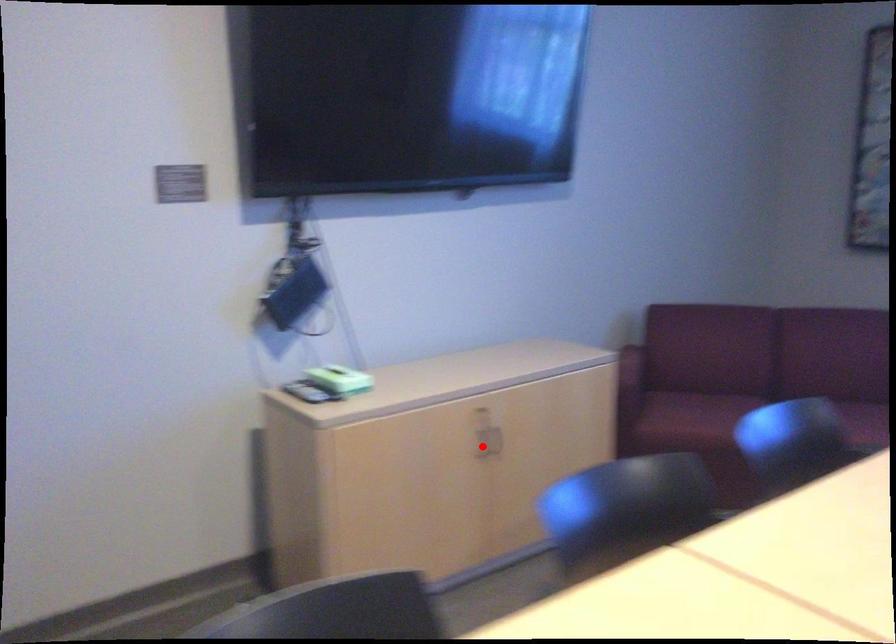
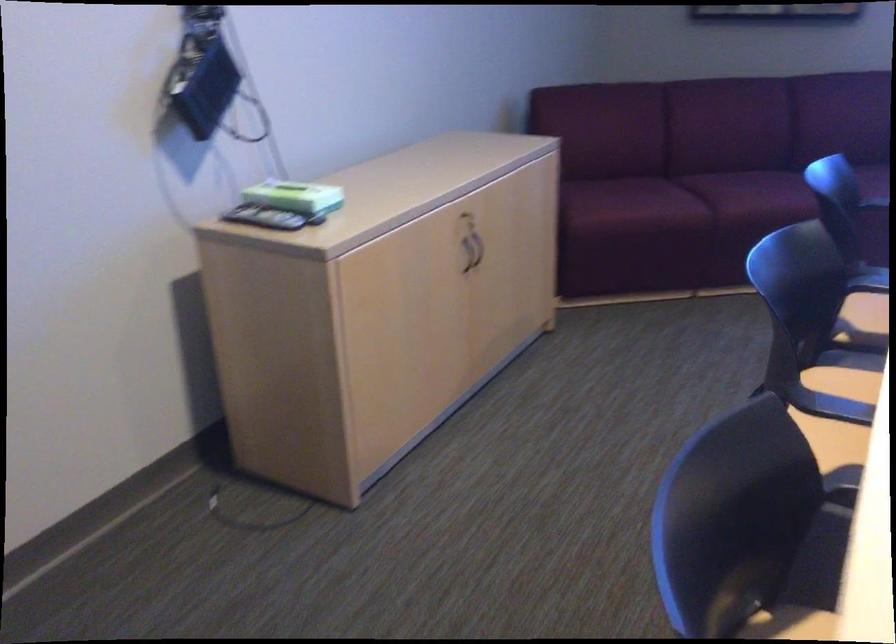
Question: I am providing you with two images of the same scene from different viewpoints. A red point is shown in image1. For the corresponding object point in image2, is it positioned nearer or farther from the camera?

Choices:
 (A) Nearer
 (B) Farther

Answer: (A)